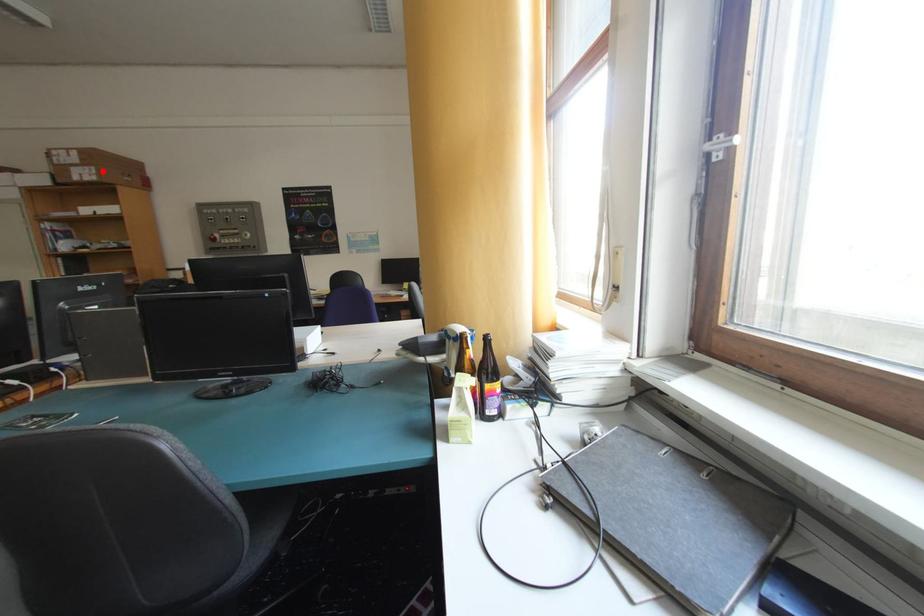
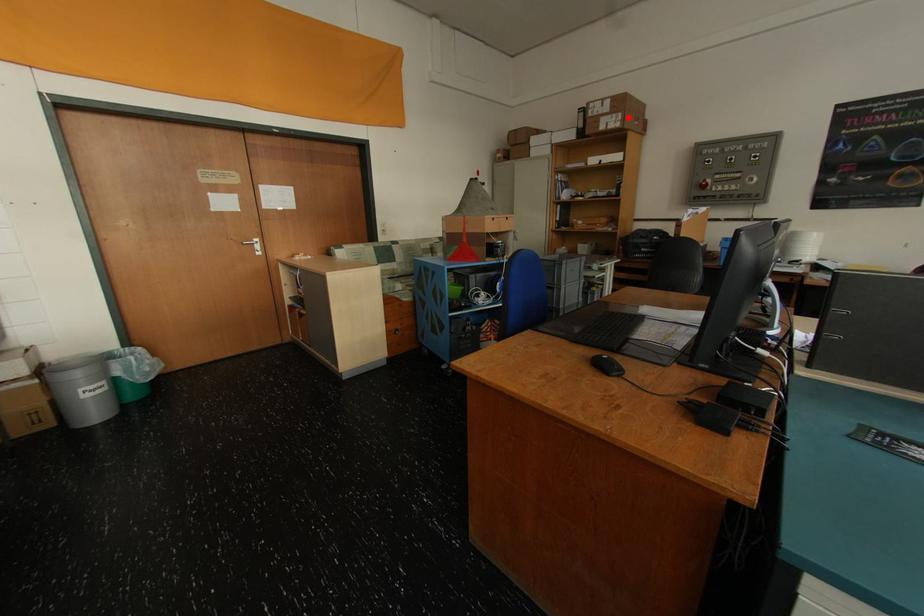
I am providing you with two images of the same scene from different viewpoints. A red point is marked on the first image and another point is marked on the second image. Does the point marked in image1 correspond to the same location as the one in image2?

Yes